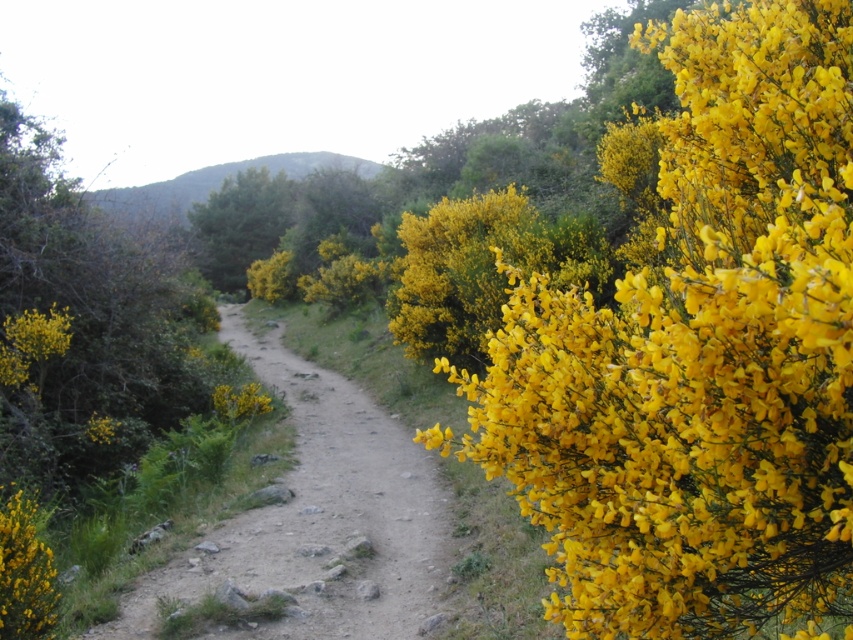
You are standing on the dirt path and looking towards the mountain range. Which object is positioned to the left when comparing the green leafy hillside at upper center and the yellow matte bush at lower left?

The green leafy hillside at upper center is positioned to the left of the yellow matte bush at lower left according to the spatial arrangement described.

You are a hiker who wants to take a photo of the yellow fluffy bush at right and the green leafy hillside at upper center. Which object should you focus on first if you want both to be in focus without adjusting your camera settings?

The yellow fluffy bush at right is shorter than the green leafy hillside at upper center, so you should focus on the green leafy hillside at upper center first to ensure both are in focus.